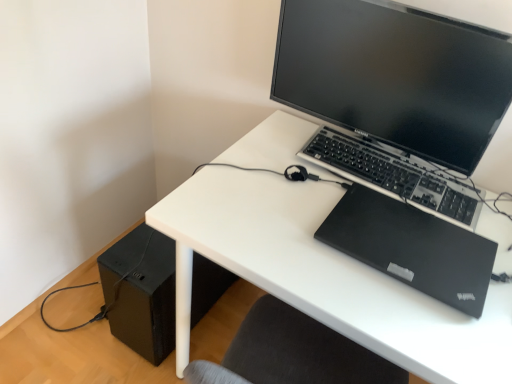
Locate an element on the screen. This screenshot has width=512, height=384. free spot above white matte desk at center (from a real-world perspective) is located at coordinates (386, 219).